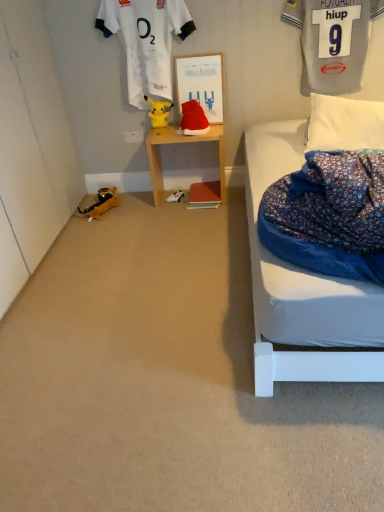
Question: Which is correct: velvet red santa hat at center, placed as the third toy when sorted from left to right, is inside gray jersey at upper right, which is counted as the first clothing, starting from the right, or outside of it?

Choices:
 (A) outside
 (B) inside

Answer: (A)

Question: From the image's perspective, is velvet red santa hat at center, marked as the 2th toy in a top-to-bottom arrangement, located above or below gray jersey at upper right, which is counted as the first clothing, starting from the right?

Choices:
 (A) above
 (B) below

Answer: (B)

Question: Estimate the real-world distances between objects in this image. Which object is closer to the white soft pillow at right?

Choices:
 (A) white plastic power outlet at lower center
 (B) gray jersey at upper right, marked as the second clothing in a left-to-right arrangement
 (C) wooden nightstand at center
 (D) white plastic game controller at center
 (E) white jersey at upper left, the second clothing positioned from the right

Answer: (B)

Question: Estimate the real-world distances between objects in this image. Which object is farther from the wooden nightstand at center?

Choices:
 (A) matte cardboard bulletin board at center
 (B) white jersey at upper left, the second clothing positioned from the right
 (C) yellow rubber duck at lower left, the first toy when ordered from left to right
 (D) white soft pillow at right
 (E) white plastic game controller at center

Answer: (D)